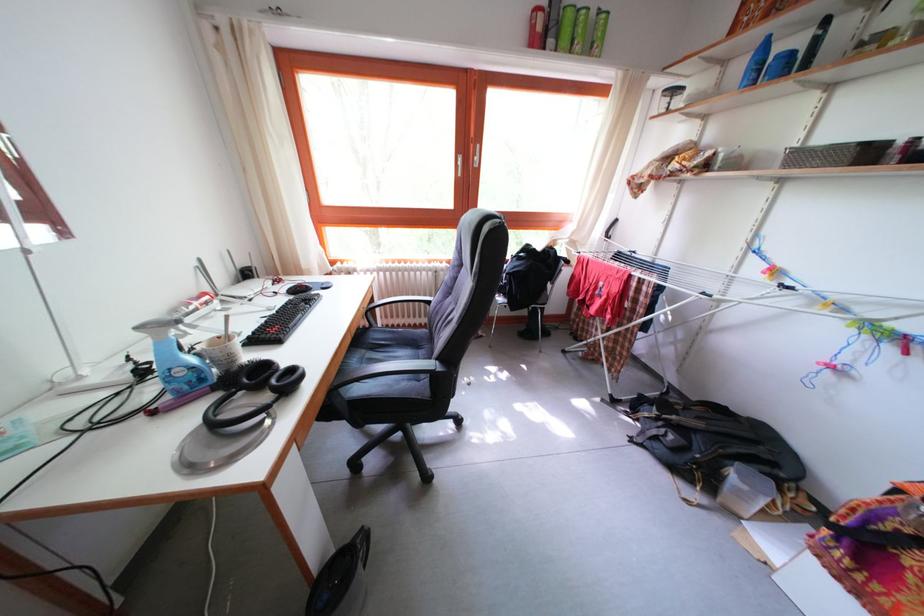
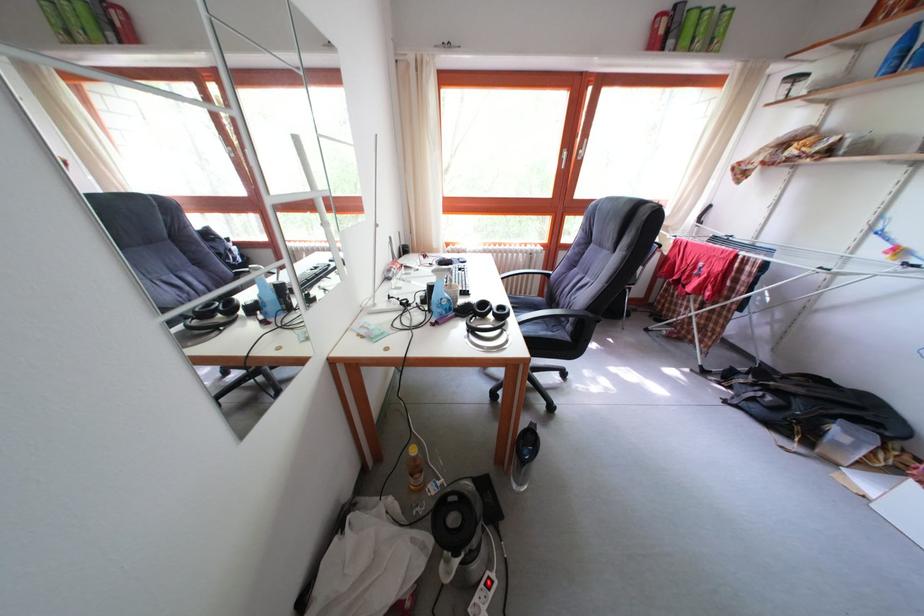
Question: Based on the continuous images, in which direction is the camera rotating? Reply with the corresponding letter.

Choices:
 (A) Left
 (B) Right
 (C) Up
 (D) Down

Answer: (A)